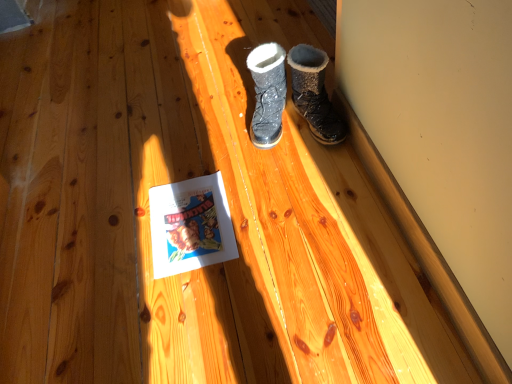
Find the location of a particular element. Image resolution: width=512 pixels, height=384 pixels. vacant point to the left of dark brown suede boot at upper right, which appears as the first footwear when viewed from the right is located at coordinates (258, 151).